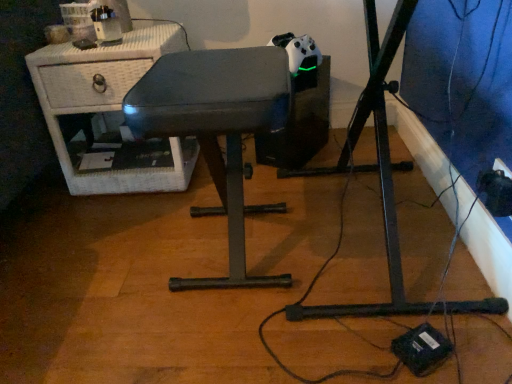
Where is `vacant space behind metallic gray stool at center, the second furniture in the left-to-right sequence`? The width and height of the screenshot is (512, 384). vacant space behind metallic gray stool at center, the second furniture in the left-to-right sequence is located at coordinates tap(216, 191).